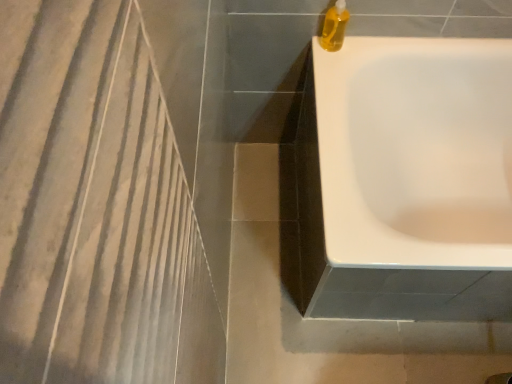
This screenshot has width=512, height=384. Identify the location of translucent yellow liquid at top right. (334, 27).

What do you see at coordinates (334, 27) in the screenshot? The width and height of the screenshot is (512, 384). I see `translucent yellow liquid at top right` at bounding box center [334, 27].

Looking at this image, in order to face translucent yellow liquid at top right, should I rotate leftwards or rightwards?

To face it directly, rotate right by 11.187 degrees.

Describe the element at coordinates (415, 151) in the screenshot. I see `white glossy bathtub at upper right` at that location.

Where is `white glossy bathtub at upper right`? This screenshot has width=512, height=384. white glossy bathtub at upper right is located at coordinates (415, 151).

In order to click on translucent yellow liquid at top right in this screenshot , I will do `click(334, 27)`.

Is translucent yellow liquid at top right to the left of white glossy bathtub at upper right from the viewer's perspective?

Indeed, translucent yellow liquid at top right is positioned on the left side of white glossy bathtub at upper right.

Which object is further away from the camera taking this photo, translucent yellow liquid at top right or white glossy bathtub at upper right?

translucent yellow liquid at top right.

Is point (327, 47) closer to viewer compared to point (397, 259)?

No, it is not.

From the image's perspective, between translucent yellow liquid at top right and white glossy bathtub at upper right, which one is located above?

translucent yellow liquid at top right, from the image's perspective.

From a real-world perspective, between translucent yellow liquid at top right and white glossy bathtub at upper right, who is vertically higher?

translucent yellow liquid at top right, from a real-world perspective.

Considering the sizes of objects translucent yellow liquid at top right and white glossy bathtub at upper right in the image provided, who is wider, translucent yellow liquid at top right or white glossy bathtub at upper right?

white glossy bathtub at upper right.

In the scene shown: Who is shorter, translucent yellow liquid at top right or white glossy bathtub at upper right?

With less height is translucent yellow liquid at top right.

Which of these two, translucent yellow liquid at top right or white glossy bathtub at upper right, is bigger?

Result: white glossy bathtub at upper right.

Is translucent yellow liquid at top right inside the boundaries of white glossy bathtub at upper right, or outside?

The correct answer is: outside.

Does translucent yellow liquid at top right touch white glossy bathtub at upper right?

No, translucent yellow liquid at top right is not touching white glossy bathtub at upper right.

From the picture: Is translucent yellow liquid at top right oriented away from white glossy bathtub at upper right?

No, translucent yellow liquid at top right's orientation is not away from white glossy bathtub at upper right.

What's the angular difference between translucent yellow liquid at top right and white glossy bathtub at upper right's facing directions?

There is a 89-degree angle between the facing directions of translucent yellow liquid at top right and white glossy bathtub at upper right.

The height and width of the screenshot is (384, 512). What are the coordinates of `bathtub below the translucent yellow liquid at top right (from a real-world perspective)` in the screenshot? It's located at (415, 151).

Considering the positions of objects white glossy bathtub at upper right and translucent yellow liquid at top right in the image provided, who is more to the right, white glossy bathtub at upper right or translucent yellow liquid at top right?

From the viewer's perspective, white glossy bathtub at upper right appears more on the right side.

Is white glossy bathtub at upper right positioned in front of translucent yellow liquid at top right?

Yes, white glossy bathtub at upper right is in front of translucent yellow liquid at top right.

Considering the points (490, 259) and (328, 26), which point is behind, point (490, 259) or point (328, 26)?

The point (328, 26) is farther from the camera.

From the image's perspective, between white glossy bathtub at upper right and translucent yellow liquid at top right, which one is located above?

translucent yellow liquid at top right is shown above in the image.

From a real-world perspective, is white glossy bathtub at upper right physically above translucent yellow liquid at top right?

Actually, white glossy bathtub at upper right is physically below translucent yellow liquid at top right in the real world.

Considering the relative sizes of white glossy bathtub at upper right and translucent yellow liquid at top right in the image provided, is white glossy bathtub at upper right wider than translucent yellow liquid at top right?

Correct, the width of white glossy bathtub at upper right exceeds that of translucent yellow liquid at top right.

Which of these two, white glossy bathtub at upper right or translucent yellow liquid at top right, stands taller?

white glossy bathtub at upper right is taller.

Can you confirm if white glossy bathtub at upper right is bigger than translucent yellow liquid at top right?

Yes.

Would you say white glossy bathtub at upper right is outside translucent yellow liquid at top right?

Yes, white glossy bathtub at upper right is outside of translucent yellow liquid at top right.

Is white glossy bathtub at upper right placed right next to translucent yellow liquid at top right?

No, white glossy bathtub at upper right is not touching translucent yellow liquid at top right.

Consider the image. Is white glossy bathtub at upper right aimed at translucent yellow liquid at top right?

No, white glossy bathtub at upper right is not facing towards translucent yellow liquid at top right.

Can you tell me how much white glossy bathtub at upper right and translucent yellow liquid at top right differ in facing direction?

white glossy bathtub at upper right and translucent yellow liquid at top right are facing 89 degrees away from each other.

Find the location of a particular element. Image resolution: width=512 pixels, height=384 pixels. bathtub in front of the translucent yellow liquid at top right is located at coordinates (415, 151).

Identify the location of bathtub that appears on the right of translucent yellow liquid at top right. The width and height of the screenshot is (512, 384). (415, 151).

I want to click on liquid behind the white glossy bathtub at upper right, so click(x=334, y=27).